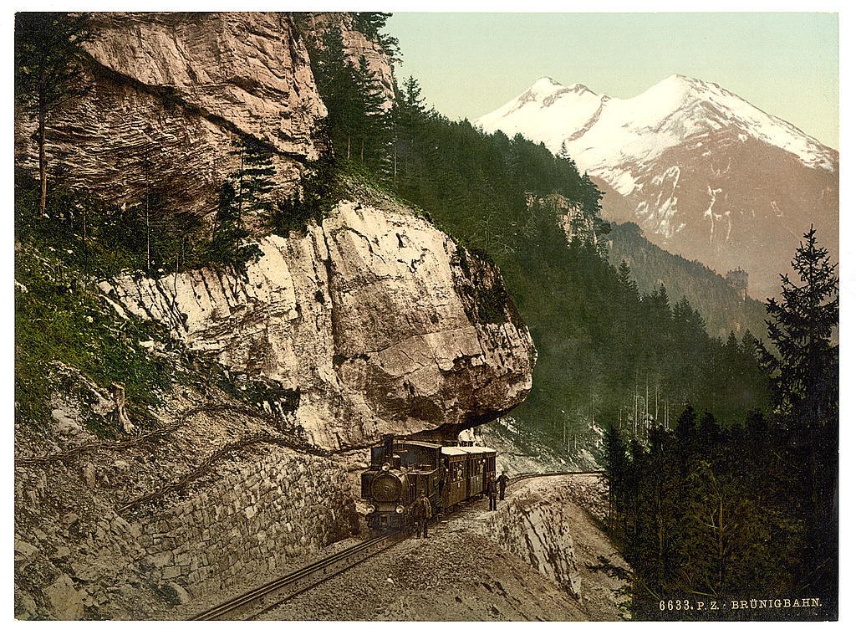
From the picture: You are a photographer planning to take a photo of the black metal train at center and the smooth metal train track at center. Based on the scene, which object should you focus on first if you want to capture both clearly in your shot?

The black metal train at center is larger in size than the smooth metal train track at center, so you should focus on the black metal train at center first to ensure it is in clear focus before adjusting for the track.

From the picture: You are a photographer standing at the edge of the cliff, wanting to capture the black metal train at center and the smooth metal train track at center in your photo. Which object is closer to your camera lens?

The black metal train at center is closer to the camera lens because it is positioned further to the viewer than the smooth metal train track at center.